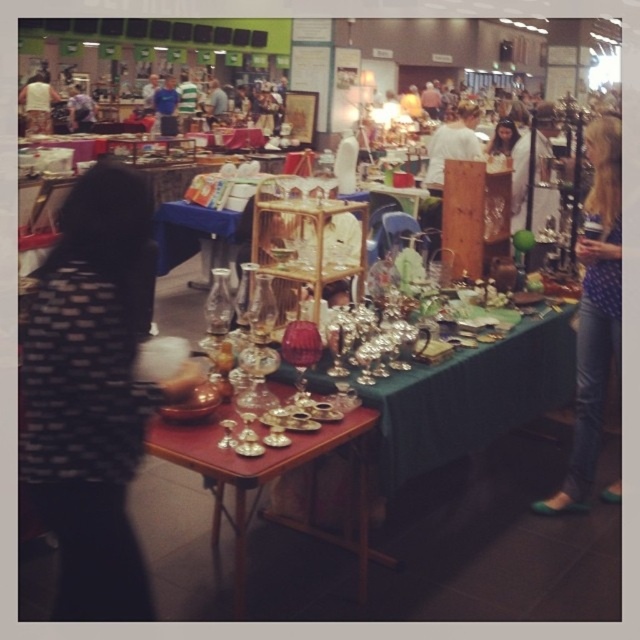
Is black textured shirt at left shorter than shiny metallic tableware at center?

No, black textured shirt at left is not shorter than shiny metallic tableware at center.

Is black textured shirt at left in front of shiny metallic tableware at center?

That is True.

You are a GUI agent. You are given a task and a screenshot of the screen. Output one action in this format:
    pyautogui.click(x=<x>, y=<y>)
    Task: Click on the black textured shirt at left
    The image size is (640, 640).
    Given the screenshot: What is the action you would take?
    pyautogui.click(x=93, y=392)

Can you confirm if black textured shirt at left is positioned to the left of blue denim jeans at lower right?

Yes, black textured shirt at left is to the left of blue denim jeans at lower right.

Is black textured shirt at left to the right of blue denim jeans at lower right from the viewer's perspective?

No, black textured shirt at left is not to the right of blue denim jeans at lower right.

Does point (109, 326) come farther from viewer compared to point (582, 451)?

No, (109, 326) is closer to viewer.

Image resolution: width=640 pixels, height=640 pixels. Identify the location of black textured shirt at left. (93, 392).

Is black textured shirt at left below matte black hair at center?

Yes.

Which of these two, black textured shirt at left or matte black hair at center, stands taller?

black textured shirt at left is taller.

Between point (150, 292) and point (484, 150), which one is positioned in front?

Point (150, 292) is more forward.

This screenshot has width=640, height=640. I want to click on black textured shirt at left, so click(93, 392).